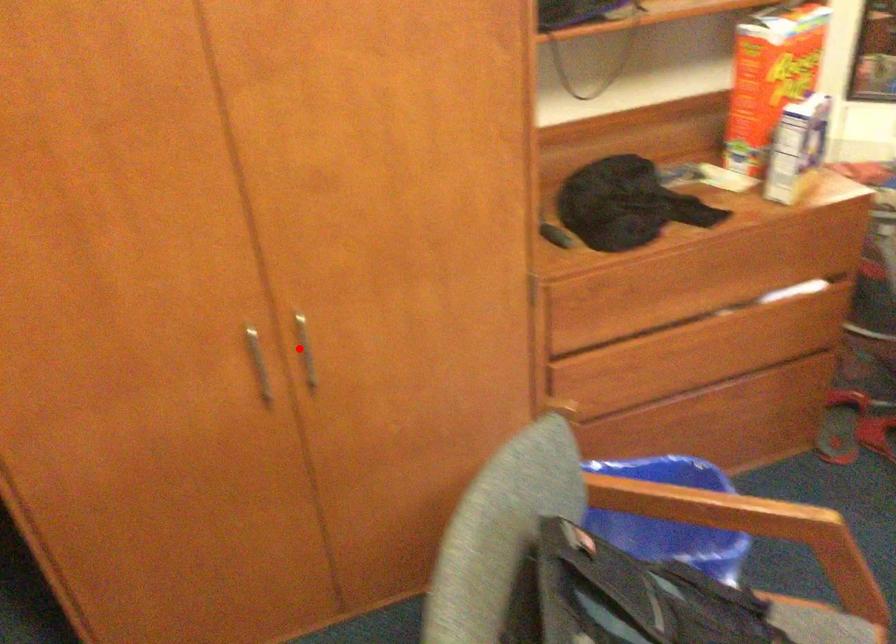
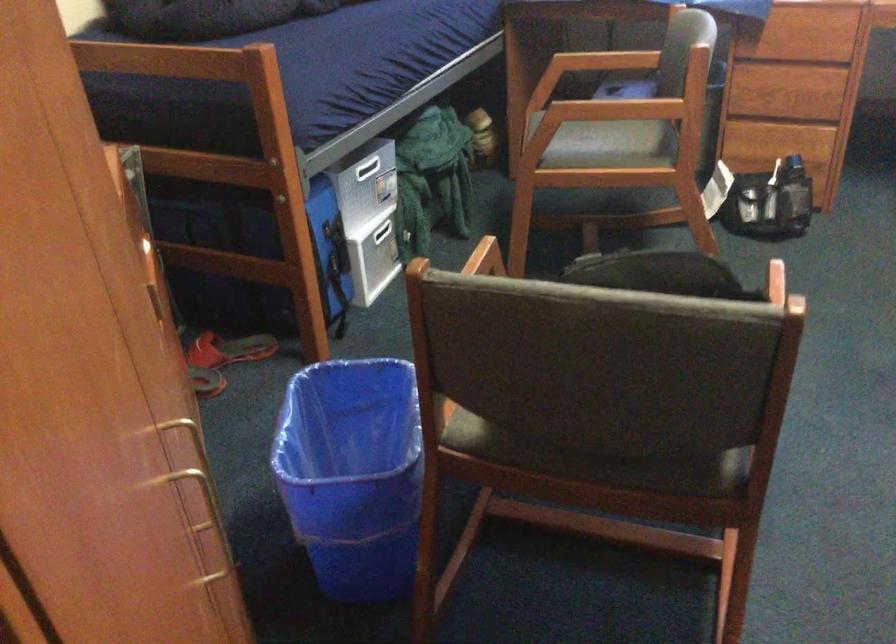
Question: I am providing you with two images of the same scene from different viewpoints. A red point is shown in image1. For the corresponding object point in image2, is it positioned nearer or farther from the camera?

Choices:
 (A) Nearer
 (B) Farther

Answer: (A)